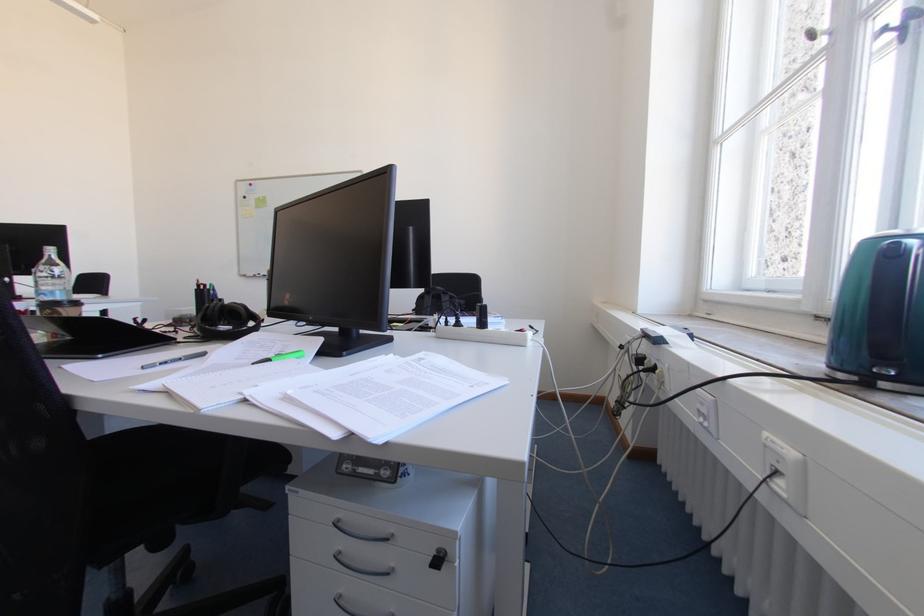
Describe the element at coordinates (181, 469) in the screenshot. I see `the black chair sitting surface` at that location.